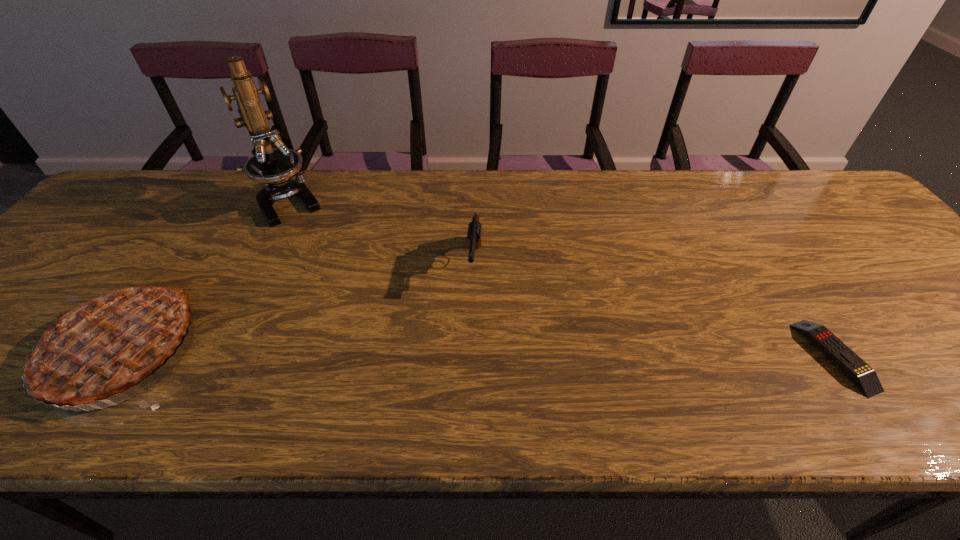
At what (x,y) coordinates should I click in order to perform the action: click on vacant position located 0.130m at the eyepiece of the tallest object. Please return your answer as a coordinate pair (x, y). This screenshot has height=540, width=960. Looking at the image, I should click on (x=317, y=249).

Identify the location of free space located 0.110m at the eyepiece of the tallest object. [x=314, y=245].

Where is `blank area located 0.360m at the eyepiece of the tallest object`? blank area located 0.360m at the eyepiece of the tallest object is located at coordinates (353, 305).

Image resolution: width=960 pixels, height=540 pixels. What are the coordinates of `object that is at the far edge` in the screenshot? It's located at (275, 167).

The image size is (960, 540). What are the coordinates of `object that is at the near edge` in the screenshot? It's located at (864, 376).

In the image, there is a desktop. Identify the location of free space at the far edge. (211, 191).

Image resolution: width=960 pixels, height=540 pixels. What are the coordinates of `free spot at the near edge of the desktop` in the screenshot? It's located at (764, 347).

This screenshot has height=540, width=960. I want to click on free space at the right edge, so click(x=860, y=247).

In the image, there is a desktop. Identify the location of free space at the far left corner. The height and width of the screenshot is (540, 960). (145, 189).

Image resolution: width=960 pixels, height=540 pixels. What are the coordinates of `empty location between the shortest object and the second object from right to left` in the screenshot? It's located at (655, 310).